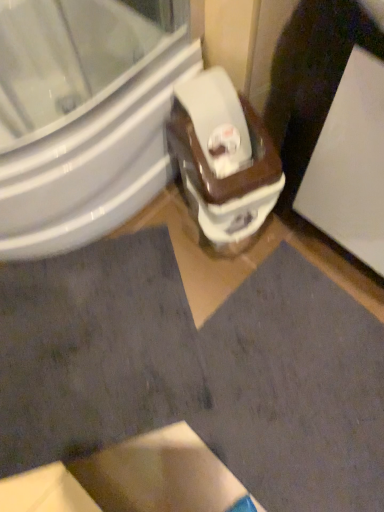
Question: From a real-world perspective, is white glossy toilet at center located beneath white glossy screen door at upper right?

Choices:
 (A) no
 (B) yes

Answer: (B)

Question: Is white glossy toilet at center positioned with its back to white glossy screen door at upper right?

Choices:
 (A) yes
 (B) no

Answer: (A)

Question: From a real-world perspective, is white glossy toilet at center on white glossy screen door at upper right?

Choices:
 (A) yes
 (B) no

Answer: (B)

Question: Considering the relative positions of white glossy toilet at center and white glossy screen door at upper right in the image provided, is white glossy toilet at center behind white glossy screen door at upper right?

Choices:
 (A) no
 (B) yes

Answer: (B)

Question: Is white glossy toilet at center completely or partially outside of white glossy screen door at upper right?

Choices:
 (A) no
 (B) yes

Answer: (B)

Question: Is white glossy toilet at center at the left side of white glossy screen door at upper right?

Choices:
 (A) no
 (B) yes

Answer: (B)

Question: Considering the relative positions of white glossy bidet at center and white glossy screen door at upper right in the image provided, is white glossy bidet at center to the left of white glossy screen door at upper right from the viewer's perspective?

Choices:
 (A) no
 (B) yes

Answer: (B)

Question: Can we say white glossy bidet at center lies outside white glossy screen door at upper right?

Choices:
 (A) yes
 (B) no

Answer: (A)

Question: Is white glossy bidet at center at the right side of white glossy screen door at upper right?

Choices:
 (A) no
 (B) yes

Answer: (A)

Question: Is white glossy bidet at center thinner than white glossy screen door at upper right?

Choices:
 (A) yes
 (B) no

Answer: (B)

Question: From the image's perspective, is white glossy bidet at center above white glossy screen door at upper right?

Choices:
 (A) yes
 (B) no

Answer: (A)

Question: Is white glossy screen door at upper right at the back of white glossy bidet at center?

Choices:
 (A) yes
 (B) no

Answer: (B)

Question: Is dark gray fabric at lower left at the left side of white glossy toilet at center?

Choices:
 (A) yes
 (B) no

Answer: (A)